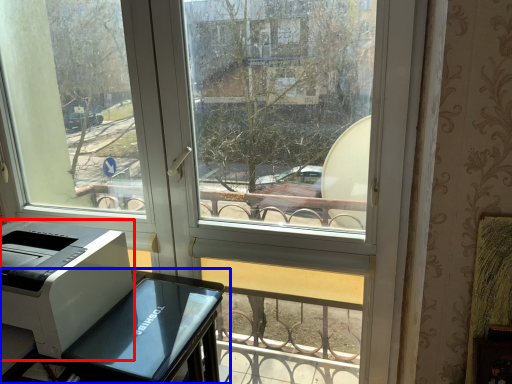
Question: Which of the following is the closest to the observer, printer (highlighted by a red box) or furniture (highlighted by a blue box)?

Choices:
 (A) printer
 (B) furniture

Answer: (B)